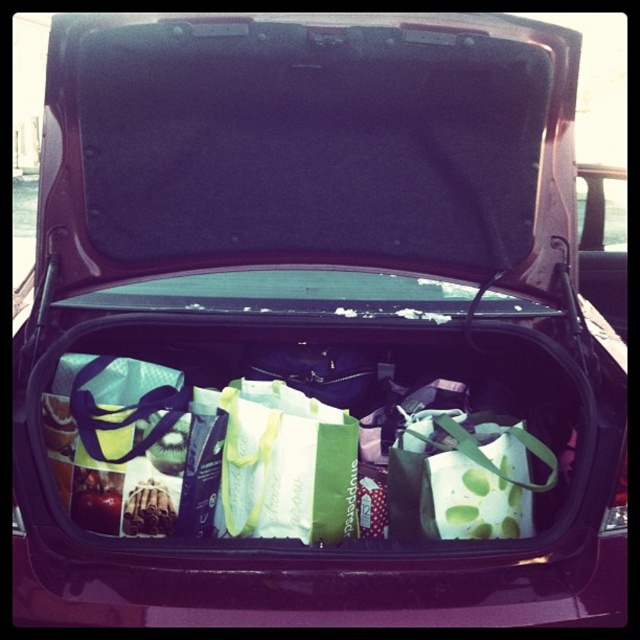
Question: Does green paper gift bag at center have a greater width compared to green dotted paper bag at center?

Choices:
 (A) yes
 (B) no

Answer: (B)

Question: Can you confirm if green paper gift bag at center is thinner than green dotted paper bag at center?

Choices:
 (A) no
 (B) yes

Answer: (B)

Question: Among these objects, which one is nearest to the camera?

Choices:
 (A) green dotted paper bag at center
 (B) green paper gift bag at center

Answer: (A)

Question: Which of the following is the closest to the observer?

Choices:
 (A) (323, 536)
 (B) (467, 486)

Answer: (B)

Question: Is green paper gift bag at center thinner than green dotted paper bag at center?

Choices:
 (A) no
 (B) yes

Answer: (B)